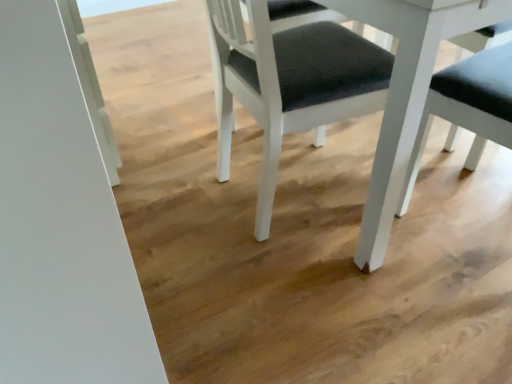
Question: Considering the positions of white matte table at center and white matte chair at center in the image, is white matte table at center bigger or smaller than white matte chair at center?

Choices:
 (A) small
 (B) big

Answer: (B)

Question: Is point (391, 34) closer or farther from the camera than point (259, 21)?

Choices:
 (A) farther
 (B) closer

Answer: (B)

Question: From a real-world perspective, is white matte table at center above or below white matte chair at center?

Choices:
 (A) above
 (B) below

Answer: (A)

Question: Do you think white matte chair at center is within white matte table at center, or outside of it?

Choices:
 (A) outside
 (B) inside

Answer: (B)

Question: Considering the positions of point (268, 168) and point (412, 54), is point (268, 168) closer or farther from the camera than point (412, 54)?

Choices:
 (A) closer
 (B) farther

Answer: (B)

Question: In the image, is white matte chair at center positioned in front of or behind white matte table at center?

Choices:
 (A) front
 (B) behind

Answer: (B)

Question: Looking at their shapes, would you say white matte chair at center is wider or thinner than white matte table at center?

Choices:
 (A) thin
 (B) wide

Answer: (A)